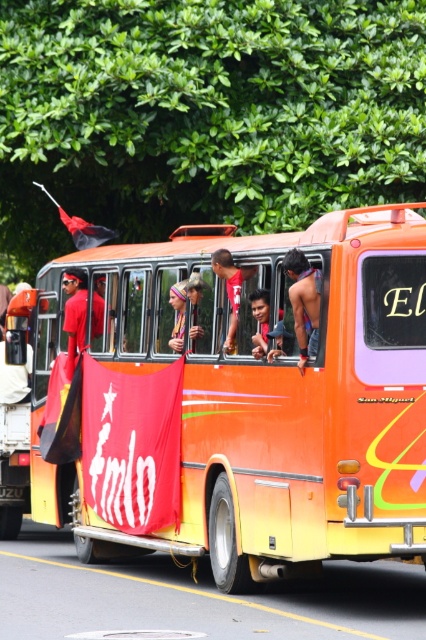
Image resolution: width=426 pixels, height=640 pixels. What do you see at coordinates (259, 401) in the screenshot?
I see `orange matte bus at center` at bounding box center [259, 401].

Is orange matte bus at center smaller than skinny man at center?

Correct, orange matte bus at center occupies less space than skinny man at center.

Measure the distance between point (241, 449) and camera.

The distance of point (241, 449) from camera is 13.47 meters.

The image size is (426, 640). What are the coordinates of `orange matte bus at center` in the screenshot? It's located at (259, 401).

Is orange matte bus at center to the right of matte red shirt at center from the viewer's perspective?

Correct, you'll find orange matte bus at center to the right of matte red shirt at center.

Does orange matte bus at center appear on the left side of matte red shirt at center?

No, orange matte bus at center is not to the left of matte red shirt at center.

Is point (284, 449) behind point (236, 269)?

No, (284, 449) is closer to viewer.

Where is `orange matte bus at center`? orange matte bus at center is located at coordinates (259, 401).

Is point (66, 291) closer to viewer compared to point (233, 320)?

No, it is not.

Which is behind, point (83, 307) or point (221, 266)?

Positioned behind is point (83, 307).

The image size is (426, 640). What are the coordinates of `red fabric flag at left` in the screenshot? It's located at (74, 314).